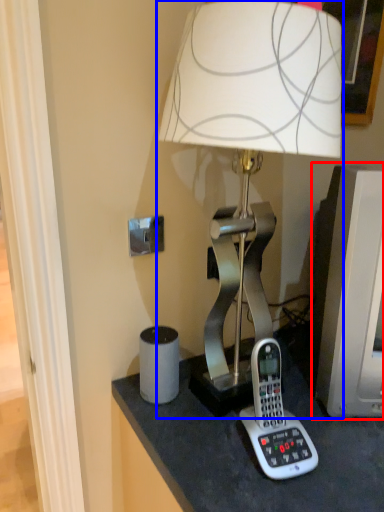
Question: Among these objects, which one is farthest to the camera, computer monitor (highlighted by a red box) or lamp (highlighted by a blue box)?

Choices:
 (A) computer monitor
 (B) lamp

Answer: (A)